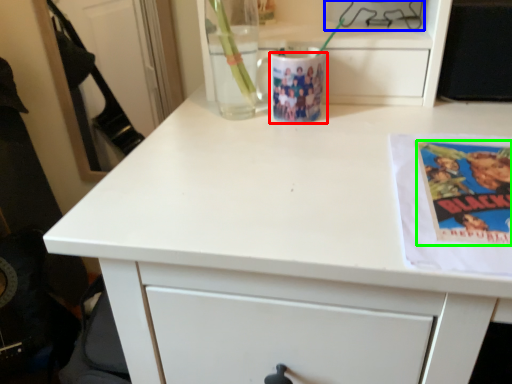
Question: Estimate the real-world distances between objects in this image. Which object is closer to mug (highlighted by a red box), appliance (highlighted by a blue box) or paperback book (highlighted by a green box)?

Choices:
 (A) appliance
 (B) paperback book

Answer: (A)